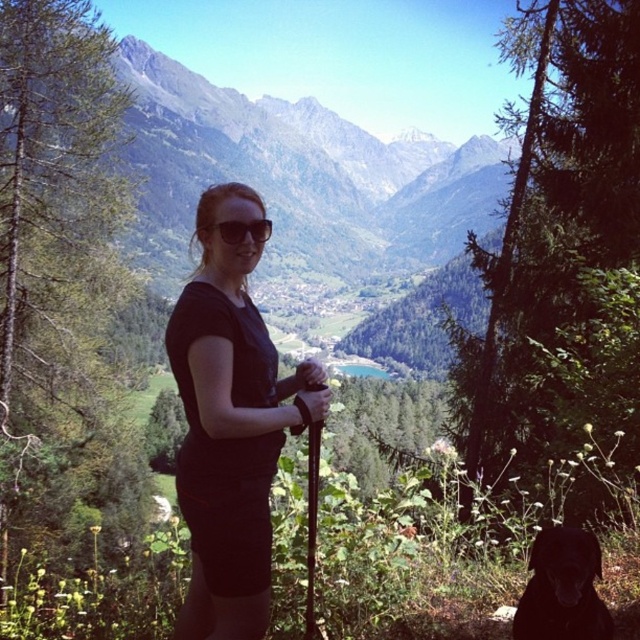
Which is behind, point (202, 472) or point (561, 600)?

The point (202, 472) is behind.

Describe the element at coordinates (230, 426) in the screenshot. I see `black matte shirt at center` at that location.

You are a GUI agent. You are given a task and a screenshot of the screen. Output one action in this format:
    pyautogui.click(x=<x>, y=<y>)
    Task: Click on the black matte shirt at center
    Image resolution: width=640 pixels, height=640 pixels.
    Given the screenshot: What is the action you would take?
    pyautogui.click(x=230, y=426)

Who is more forward, (x=580, y=531) or (x=236, y=243)?

Point (x=580, y=531) is in front.

Can you confirm if black matte dog at lower right is positioned to the left of matte black sunglasses at center?

No, black matte dog at lower right is not to the left of matte black sunglasses at center.

Locate an element on the screen. black matte dog at lower right is located at coordinates (563, 588).

Looking at this image, between black matte dog at lower right and black rubber ski pole at center, which one is positioned lower?

black matte dog at lower right is below.

Is point (579, 579) farther from viewer compared to point (312, 611)?

No, (579, 579) is in front of (312, 611).

Does point (536, 604) come closer to viewer compared to point (317, 454)?

That is True.

Where is `black matte dog at lower right`? This screenshot has width=640, height=640. black matte dog at lower right is located at coordinates (563, 588).